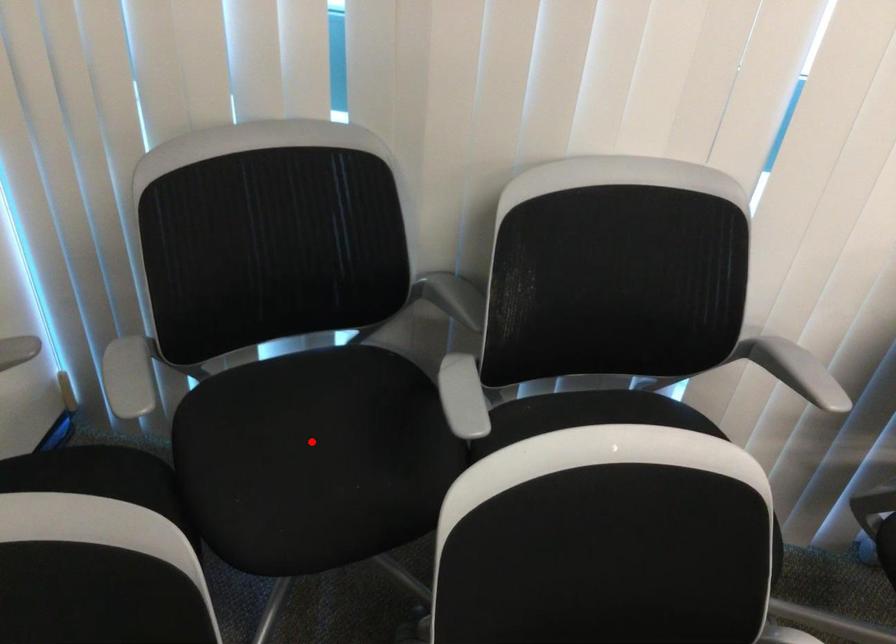
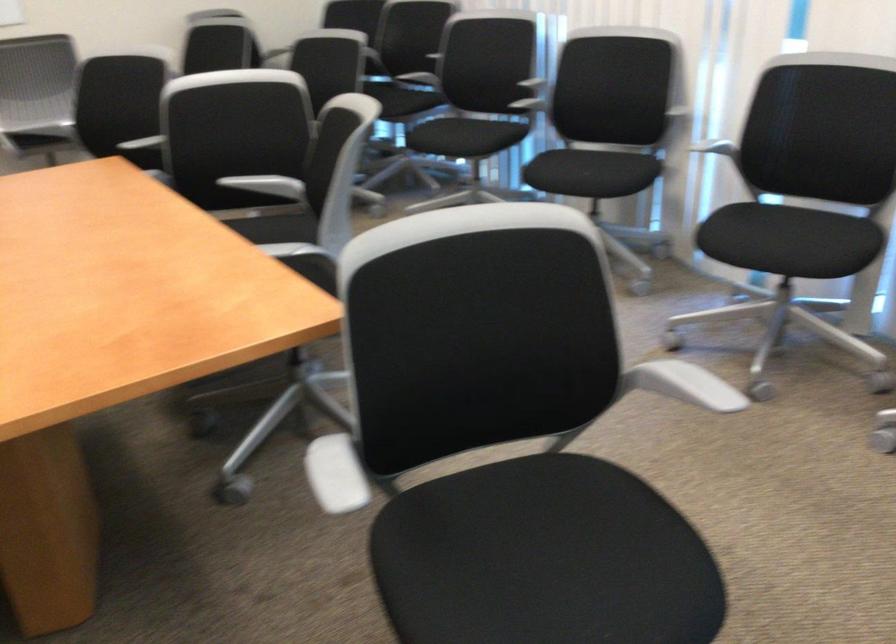
Question: I am providing you with two images of the same scene from different viewpoints. A red point is marked on the first image. At the location where the point appears in image 1, is it still visible in image 2?

Choices:
 (A) Yes
 (B) No

Answer: (B)